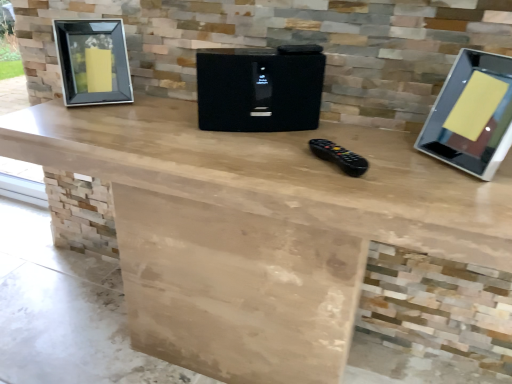
Question: Is black glass picture frame at left at the right side of silver glossy monitor at right?

Choices:
 (A) no
 (B) yes

Answer: (A)

Question: Is black glass picture frame at left facing towards silver glossy monitor at right?

Choices:
 (A) no
 (B) yes

Answer: (A)

Question: Can you confirm if black glass picture frame at left is bigger than silver glossy monitor at right?

Choices:
 (A) no
 (B) yes

Answer: (B)

Question: Can you confirm if black glass picture frame at left is thinner than silver glossy monitor at right?

Choices:
 (A) no
 (B) yes

Answer: (A)

Question: From the image's perspective, is black glass picture frame at left under silver glossy monitor at right?

Choices:
 (A) yes
 (B) no

Answer: (B)

Question: Is black glass picture frame at left turned away from silver glossy monitor at right?

Choices:
 (A) no
 (B) yes

Answer: (A)

Question: Is black textured speaker at center positioned before black glass picture frame at left?

Choices:
 (A) no
 (B) yes

Answer: (B)

Question: Is black textured speaker at center oriented towards black glass picture frame at left?

Choices:
 (A) yes
 (B) no

Answer: (B)

Question: Can you confirm if black textured speaker at center is positioned to the left of black glass picture frame at left?

Choices:
 (A) no
 (B) yes

Answer: (A)

Question: From a real-world perspective, is black textured speaker at center under black glass picture frame at left?

Choices:
 (A) yes
 (B) no

Answer: (A)

Question: Is black textured speaker at center taller than black glass picture frame at left?

Choices:
 (A) yes
 (B) no

Answer: (B)

Question: From a real-world perspective, is black textured speaker at center on black glass picture frame at left?

Choices:
 (A) no
 (B) yes

Answer: (A)

Question: Is silver glossy monitor at right to the left of black textured speaker at center from the viewer's perspective?

Choices:
 (A) yes
 (B) no

Answer: (B)